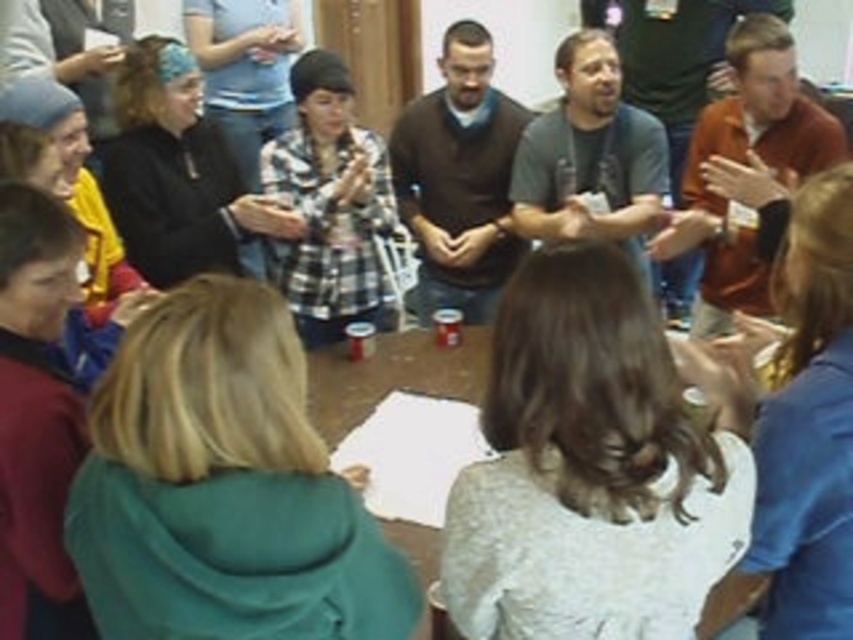
You are a photographer trying to capture a candid shot of the blue fabric shirt at upper right and the maroon fleece jacket at lower left. If you want to ensure both subjects are fully visible in the frame, which one should you focus on first considering their widths?

The blue fabric shirt at upper right might be wider than maroon fleece jacket at lower left, so you should focus on the blue fabric shirt at upper right first to ensure it fits within the frame.

You are standing at the center of the room and want to reach the blue fabric shirt at upper right located at point (804, 433). Is there a clear path to it without moving any objects?

The blue fabric shirt at upper right is located at point (804, 433). Since the path isn not mentioned to have any obstructions, you can likely reach it without moving objects.